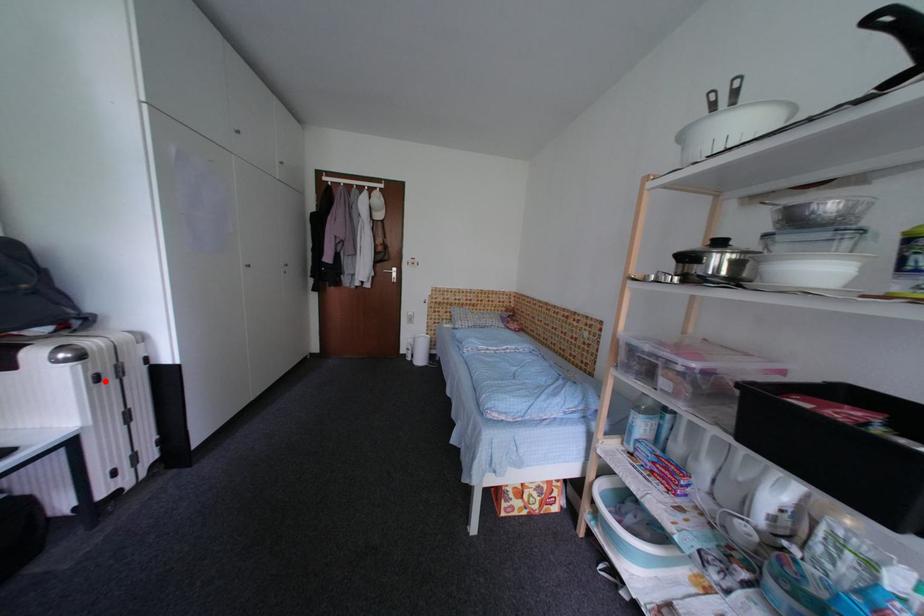
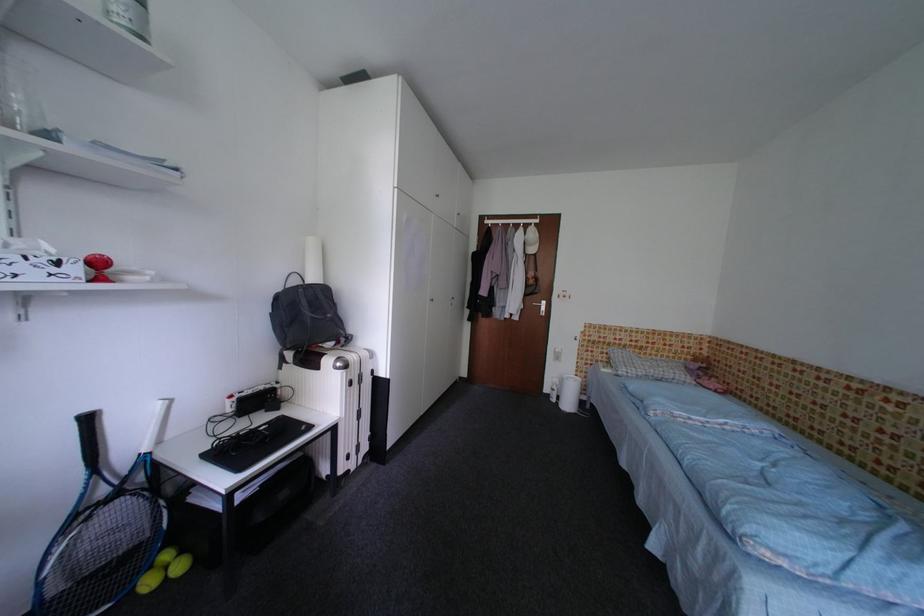
Locate, in the second image, the point that corresponds to the highlighted location in the first image.

(359, 386)